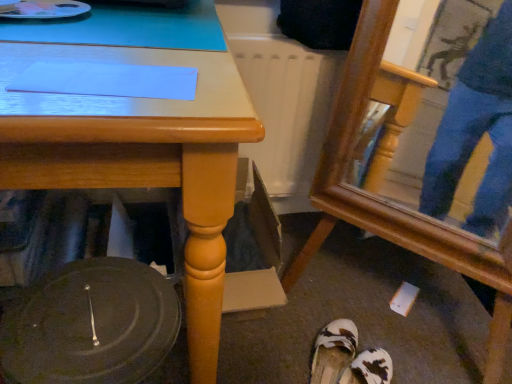
Question: Is white textured sandals at lower center, the second footwear when ordered from top to bottom, wider or thinner than white fabric sandals at lower center, the first footwear in the top-to-bottom sequence?

Choices:
 (A) wide
 (B) thin

Answer: (A)

Question: Is white textured sandals at lower center, which is the 1th footwear in bottom-to-top order, taller or shorter than white fabric sandals at lower center, which ranks as the second footwear in bottom-to-top order?

Choices:
 (A) short
 (B) tall

Answer: (A)

Question: Estimate the real-world distances between objects in this image. Which object is farther from the matte wood desk at center?

Choices:
 (A) white textured sandals at lower center, which is the 1th footwear in bottom-to-top order
 (B) wooden swivel chair at lower right
 (C) white fabric sandals at lower center, which ranks as the second footwear in bottom-to-top order

Answer: (A)

Question: Which object is positioned closest to the wooden swivel chair at lower right?

Choices:
 (A) matte wood desk at center
 (B) white textured sandals at lower center, the second footwear when ordered from top to bottom
 (C) white fabric sandals at lower center, the first footwear in the top-to-bottom sequence

Answer: (C)